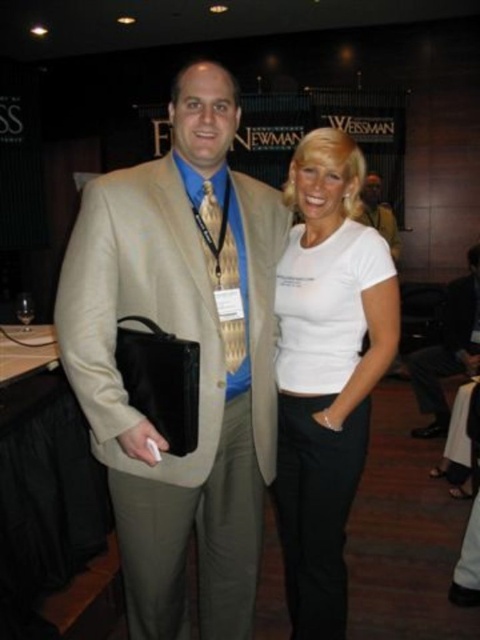
Question: Estimate the real-world distances between objects in this image. Which object is closer to the white matte shirt at center?

Choices:
 (A) matte beige suit at center
 (B) light beige suit at center

Answer: (B)

Question: Does tan fabric suit at center have a lesser width compared to light beige suit at center?

Choices:
 (A) yes
 (B) no

Answer: (B)

Question: Among these objects, which one is nearest to the camera?

Choices:
 (A) matte beige suit at center
 (B) tan fabric suit at center

Answer: (B)

Question: Where is white matte shirt at center located in relation to matte beige suit at center in the image?

Choices:
 (A) above
 (B) below

Answer: (B)

Question: Does tan fabric suit at center lie in front of matte beige suit at center?

Choices:
 (A) yes
 (B) no

Answer: (A)

Question: Which of the following is the closest to the observer?

Choices:
 (A) tan fabric suit at center
 (B) white matte shirt at center
 (C) matte beige suit at center
 (D) light beige suit at center

Answer: (A)